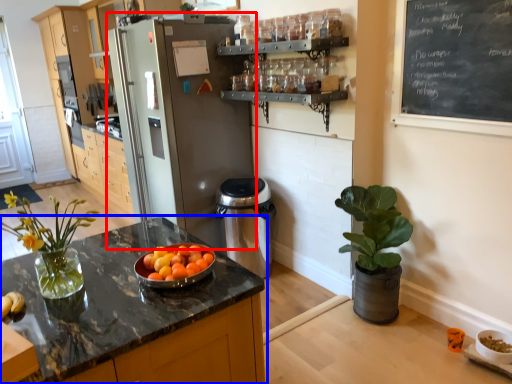
Question: Which of the following is the closest to the observer, refrigerator (highlighted by a red box) or countertop (highlighted by a blue box)?

Choices:
 (A) refrigerator
 (B) countertop

Answer: (B)